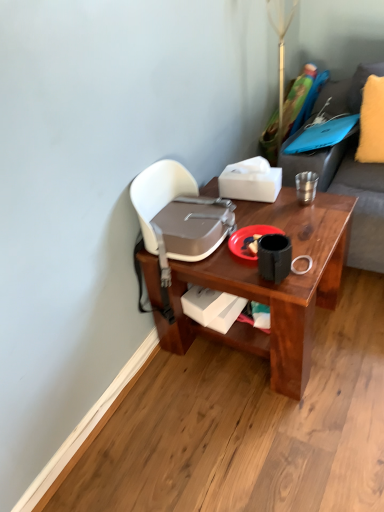
Locate an element on the screen. The width and height of the screenshot is (384, 512). vacant area that lies between metallic silver coffee cup at upper right and white matte tissue box at upper center, positioned as the 1th box in top-to-bottom order is located at coordinates (287, 197).